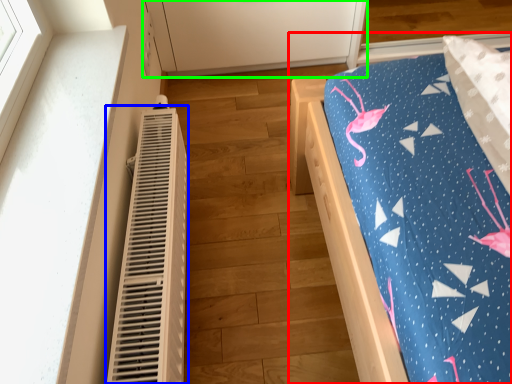
Question: Considering the real-world distances, which object is closest to furniture (highlighted by a red box)? heater (highlighted by a blue box) or cabinetry (highlighted by a green box).

Choices:
 (A) heater
 (B) cabinetry

Answer: (A)